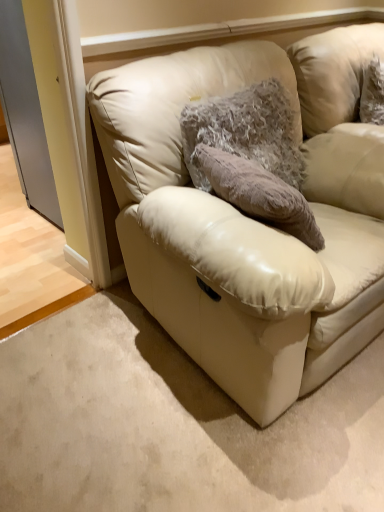
Question: Should I look upward or downward to see leather couch at center?

Choices:
 (A) down
 (B) up

Answer: (B)